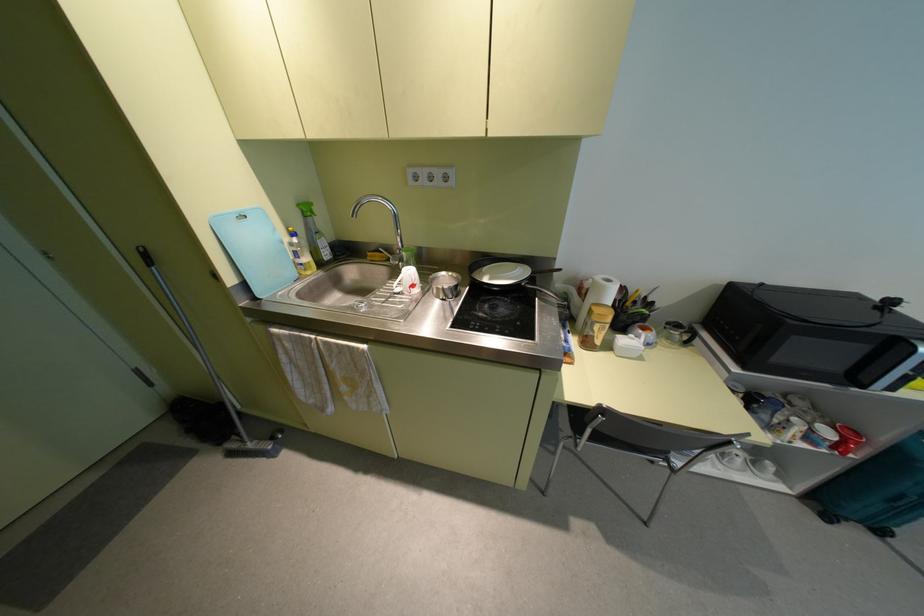
In order to click on blue cutting board in this screenshot , I will do `click(254, 249)`.